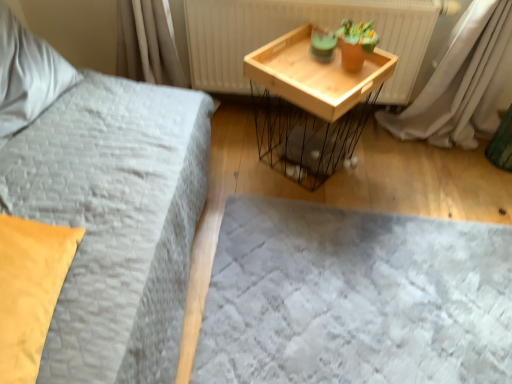
Locate an element on the screen. vacant space that is in between wooden tray at center and soft gray fabric bed frame at lower center is located at coordinates (368, 190).